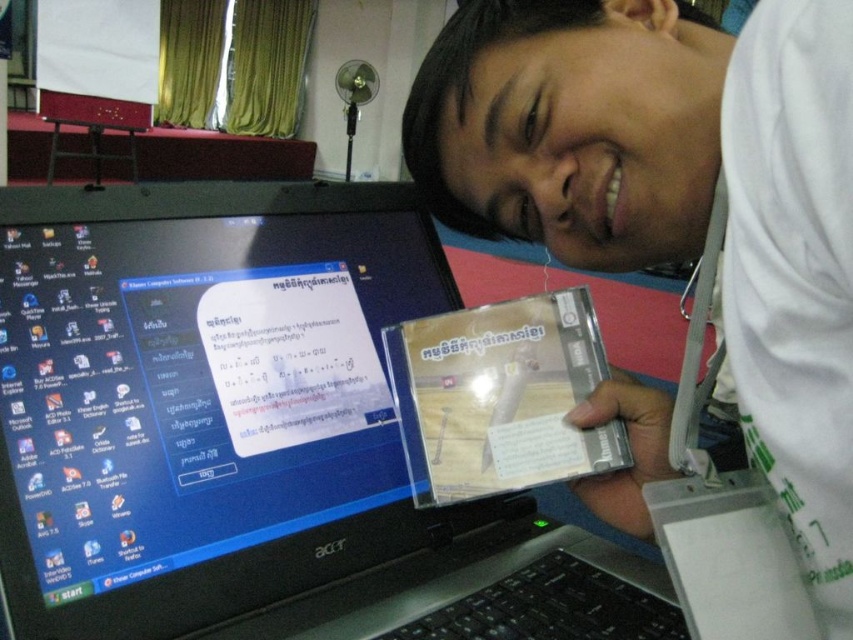
Question: Which point appears closest to the camera in this image?

Choices:
 (A) (659, 124)
 (B) (425, 544)

Answer: (A)

Question: Is black plastic laptop at center wider than white matte cd case at center?

Choices:
 (A) yes
 (B) no

Answer: (A)

Question: Is black plastic laptop at center above white matte cd case at center?

Choices:
 (A) yes
 (B) no

Answer: (B)

Question: Is black plastic laptop at center smaller than white matte cd case at center?

Choices:
 (A) yes
 (B) no

Answer: (B)